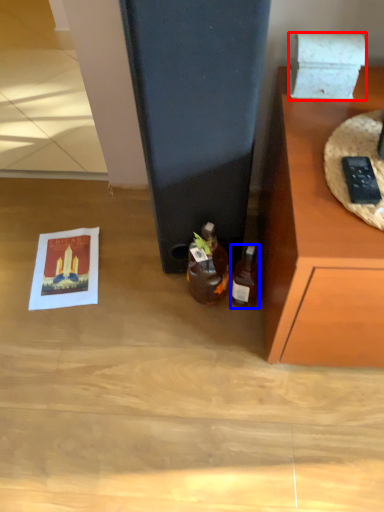
Question: Which point is further to the camera, box (highlighted by a red box) or bottle (highlighted by a blue box)?

Choices:
 (A) box
 (B) bottle

Answer: (B)